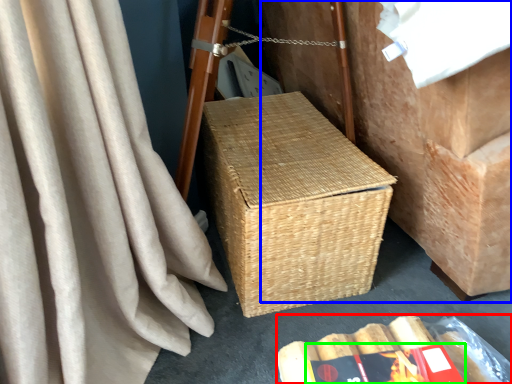
Question: Which object is the closest to the storage box (highlighted by a red box)? Choose among these: furniture (highlighted by a blue box) or paperback book (highlighted by a green box).

Choices:
 (A) furniture
 (B) paperback book

Answer: (B)